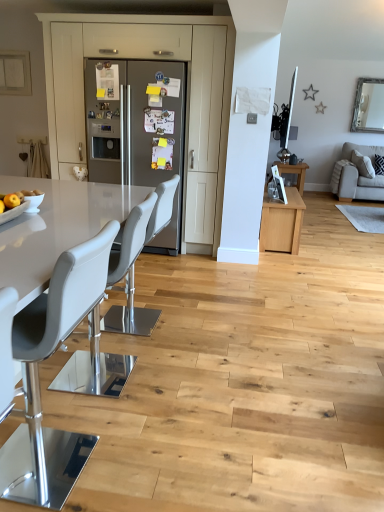
Question: Considering the relative sizes of satin stainless steel refrigerator at center and beige fabric couch at right in the image provided, is satin stainless steel refrigerator at center thinner than beige fabric couch at right?

Choices:
 (A) no
 (B) yes

Answer: (B)

Question: From a real-world perspective, is satin stainless steel refrigerator at center positioned under beige fabric couch at right based on gravity?

Choices:
 (A) yes
 (B) no

Answer: (B)

Question: Are satin stainless steel refrigerator at center and beige fabric couch at right beside each other?

Choices:
 (A) no
 (B) yes

Answer: (A)

Question: From the image's perspective, is satin stainless steel refrigerator at center under beige fabric couch at right?

Choices:
 (A) yes
 (B) no

Answer: (A)

Question: Does satin stainless steel refrigerator at center come behind beige fabric couch at right?

Choices:
 (A) yes
 (B) no

Answer: (B)

Question: Could you tell me if satin stainless steel refrigerator at center is turned towards beige fabric couch at right?

Choices:
 (A) yes
 (B) no

Answer: (B)

Question: Is gray leather chair at left, which is the 3th chair from back to front, taller than white leather chair at center, the 1th chair viewed from the back?

Choices:
 (A) no
 (B) yes

Answer: (B)

Question: Is gray leather chair at left, which is the 3th chair from back to front, closer to camera compared to white leather chair at center, positioned as the 3th chair in front-to-back order?

Choices:
 (A) no
 (B) yes

Answer: (B)

Question: Does gray leather chair at left, which is the 3th chair from back to front, have a lesser height compared to white leather chair at center, positioned as the 3th chair in front-to-back order?

Choices:
 (A) no
 (B) yes

Answer: (A)

Question: Considering the relative sizes of gray leather chair at left, which is the 3th chair from back to front, and white leather chair at center, the 1th chair viewed from the back, in the image provided, is gray leather chair at left, which is the 3th chair from back to front, smaller than white leather chair at center, the 1th chair viewed from the back,?

Choices:
 (A) no
 (B) yes

Answer: (A)

Question: Is gray leather chair at left, which appears as the 1th chair when viewed from the front, aimed at white leather chair at center, the 1th chair viewed from the back?

Choices:
 (A) no
 (B) yes

Answer: (A)

Question: Is gray leather chair at left, which is the 3th chair from back to front, surrounding white leather chair at center, the 1th chair viewed from the back?

Choices:
 (A) no
 (B) yes

Answer: (A)

Question: Does satin stainless steel refrigerator at center lie behind white leather chair at center, the 1th chair viewed from the back?

Choices:
 (A) yes
 (B) no

Answer: (A)